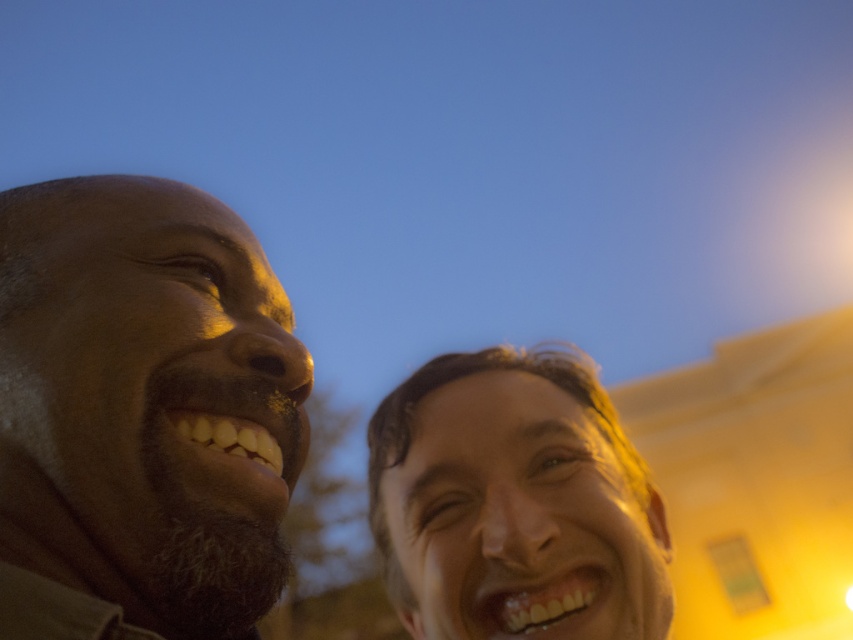
Who is positioned more to the left, matte brown beard at left or shiny golden hair at center?

Positioned to the left is matte brown beard at left.

Between point (4, 547) and point (430, 394), which one is positioned in front?

Point (4, 547)

This screenshot has width=853, height=640. Find the location of `matte brown beard at left`. matte brown beard at left is located at coordinates (141, 413).